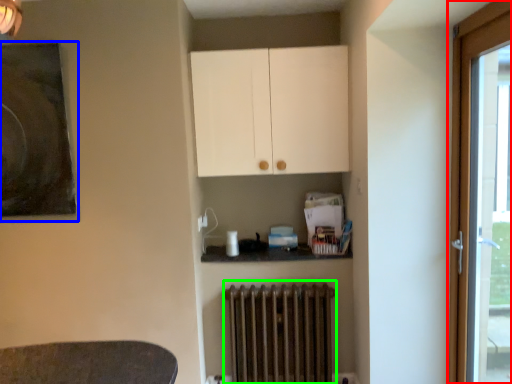
Question: Based on their relative distances, which object is nearer to door (highlighted by a red box)? Choose from picture frame (highlighted by a blue box) and radiator (highlighted by a green box).

Choices:
 (A) picture frame
 (B) radiator

Answer: (B)